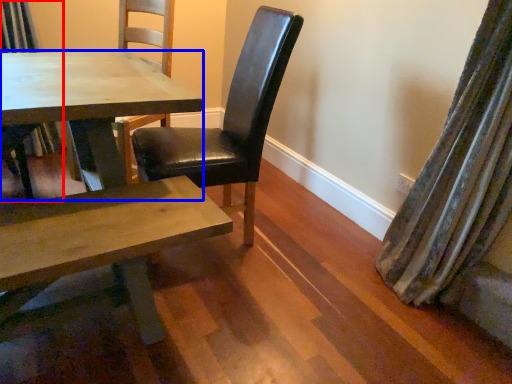
Question: Among these objects, which one is nearest to the camera, chair (highlighted by a red box) or kitchen & dining room table (highlighted by a blue box)?

Choices:
 (A) chair
 (B) kitchen & dining room table

Answer: (B)